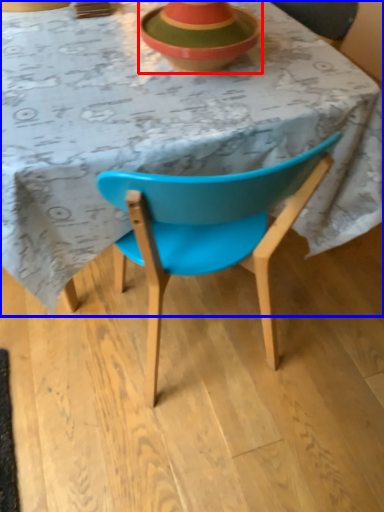
Question: Which object appears farthest to the camera in this image, bowl (highlighted by a red box) or table (highlighted by a blue box)?

Choices:
 (A) bowl
 (B) table

Answer: (A)